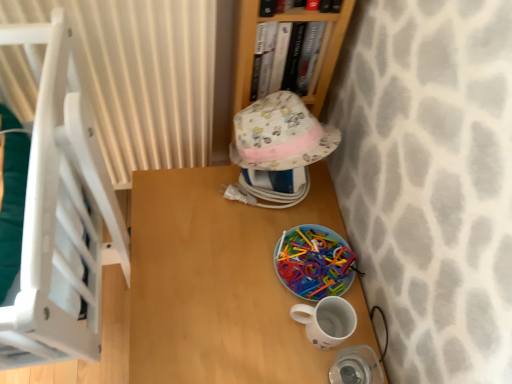
Describe the element at coordinates (326, 321) in the screenshot. I see `white glossy mug at lower right` at that location.

Measure the distance between wooden table at center and camera.

wooden table at center and camera are 31.67 inches apart.

Identify the location of wooden table at center. (222, 283).

Measure the distance between point (x=259, y=14) and camera.

They are 31.46 inches apart.

What do you see at coordinates (141, 76) in the screenshot? I see `beige striped curtain at upper left` at bounding box center [141, 76].

Where is `wooden bookshelf at upper center`? This screenshot has height=384, width=512. wooden bookshelf at upper center is located at coordinates (283, 21).

From the picture: Measure the distance between wooden bookshelf at upper center and camera.

wooden bookshelf at upper center is 30.41 inches away from camera.

This screenshot has width=512, height=384. What are the coordinates of `fluffy cotton hat at center` in the screenshot? It's located at (280, 134).

How different are the orientations of wooden table at center and fluffy cotton hat at center in degrees?

0.343 degrees.

From their relative heights in the image, would you say wooden table at center is taller or shorter than fluffy cotton hat at center?

Clearly, wooden table at center is taller compared to fluffy cotton hat at center.

Does wooden table at center lie behind fluffy cotton hat at center?

No, wooden table at center is closer to the camera.

Is wooden table at center oriented towards fluffy cotton hat at center?

No, wooden table at center is not aimed at fluffy cotton hat at center.

Which object is positioned more to the left, beige striped curtain at upper left or hardcover book at upper center?

From the viewer's perspective, beige striped curtain at upper left appears more on the left side.

Who is bigger, beige striped curtain at upper left or hardcover book at upper center?

Bigger between the two is beige striped curtain at upper left.

Is there a large distance between beige striped curtain at upper left and hardcover book at upper center?

Actually, beige striped curtain at upper left and hardcover book at upper center are a little close together.

Are hardcover book at upper center and wooden bookshelf at upper center located far from each other?

hardcover book at upper center is actually quite close to wooden bookshelf at upper center.

Who is smaller, hardcover book at upper center or wooden bookshelf at upper center?

With smaller size is hardcover book at upper center.

Which is more to the left, hardcover book at upper center or wooden bookshelf at upper center?

wooden bookshelf at upper center is more to the left.

From a real-world perspective, is hardcover book at upper center positioned above or below wooden bookshelf at upper center?

From a real-world perspective, hardcover book at upper center is physically above wooden bookshelf at upper center.

What's the angular difference between wooden table at center and wooden bookshelf at upper center's facing directions?

They differ by 85.5 degrees in their facing directions.

Relative to wooden bookshelf at upper center, is wooden table at center in front or behind?

Visually, wooden table at center is located in front of wooden bookshelf at upper center.

How distant is wooden table at center from wooden bookshelf at upper center?

wooden table at center and wooden bookshelf at upper center are 14.02 inches apart from each other.

From a real-world perspective, which is physically below, wooden table at center or wooden bookshelf at upper center?

wooden table at center, from a real-world perspective.

What's the angular difference between hardcover book at upper center and fluffy cotton hat at center's facing directions?

85.1 degrees.

Would you consider hardcover book at upper center to be distant from fluffy cotton hat at center?

hardcover book at upper center is near fluffy cotton hat at center, not far away.

Is hardcover book at upper center inside the boundaries of fluffy cotton hat at center, or outside?

hardcover book at upper center exists outside the volume of fluffy cotton hat at center.

Could you tell me if hardcover book at upper center is facing fluffy cotton hat at center?

No, hardcover book at upper center is not aimed at fluffy cotton hat at center.

Between point (348, 311) and point (238, 35), which one is positioned in front?

The point (348, 311) is closer to the camera.

Do you think white glossy mug at lower right is within wooden bookshelf at upper center, or outside of it?

white glossy mug at lower right cannot be found inside wooden bookshelf at upper center.

Identify the location of bookcase that appears behind the white glossy mug at lower right. The height and width of the screenshot is (384, 512). (283, 21).

Between white glossy mug at lower right and wooden bookshelf at upper center, which one has smaller width?

Thinner between the two is white glossy mug at lower right.

From the image's perspective, is wooden bookshelf at upper center above hardcover book at upper center?

No, from the image's perspective, wooden bookshelf at upper center is not on top of hardcover book at upper center.

Is the depth of wooden bookshelf at upper center less than that of hardcover book at upper center?

No, it is not.

Is wooden bookshelf at upper center surrounding hardcover book at upper center?

No, hardcover book at upper center is not a part of wooden bookshelf at upper center.

Can you tell me how much wooden bookshelf at upper center and hardcover book at upper center differ in facing direction?

There is a 0.00107-degree angle between the facing directions of wooden bookshelf at upper center and hardcover book at upper center.

Where is `hat behind the wooden table at center`? This screenshot has width=512, height=384. hat behind the wooden table at center is located at coordinates (280, 134).

At what (x,y) coordinates should I click in order to perform the action: click on book on the right side of beige striped curtain at upper left. Please return your answer as a coordinate pair (x, y). This screenshot has width=512, height=384. Looking at the image, I should click on (271, 7).

From the image, which object appears to be nearer to beige striped curtain at upper left, wooden bookshelf at upper center or wooden table at center?

Based on the image, wooden bookshelf at upper center appears to be nearer to beige striped curtain at upper left.

In the scene shown: When comparing their distances from white glossy mug at lower right, does fluffy cotton hat at center or wooden bookshelf at upper center seem closer?

fluffy cotton hat at center lies closer to white glossy mug at lower right than the other object.

Looking at the image, which one is located further to beige striped curtain at upper left, hardcover book at upper center or white glossy mug at lower right?

Among the two, white glossy mug at lower right is located further to beige striped curtain at upper left.

Estimate the real-world distances between objects in this image. Which object is closer to fluffy cotton hat at center, wooden bookshelf at upper center or white glossy mug at lower right?

Based on the image, wooden bookshelf at upper center appears to be nearer to fluffy cotton hat at center.

Estimate the real-world distances between objects in this image. Which object is closer to wooden bookshelf at upper center, wooden table at center or fluffy cotton hat at center?

fluffy cotton hat at center is closer to wooden bookshelf at upper center.

When comparing their distances from beige striped curtain at upper left, does wooden table at center or fluffy cotton hat at center seem further?

Based on the image, wooden table at center appears to be further to beige striped curtain at upper left.

Estimate the real-world distances between objects in this image. Which object is further from white glossy mug at lower right, beige striped curtain at upper left or wooden bookshelf at upper center?

The object further to white glossy mug at lower right is beige striped curtain at upper left.

Estimate the real-world distances between objects in this image. Which object is closer to wooden table at center, white glossy mug at lower right or wooden bookshelf at upper center?

white glossy mug at lower right is positioned closer to the anchor wooden table at center.

This screenshot has width=512, height=384. I want to click on curtain between wooden bookshelf at upper center and wooden table at center from top to bottom, so click(x=141, y=76).

This screenshot has width=512, height=384. I want to click on hat between hardcover book at upper center and white glossy mug at lower right from top to bottom, so click(280, 134).

The height and width of the screenshot is (384, 512). In order to click on hat between wooden bookshelf at upper center and white glossy mug at lower right from top to bottom in this screenshot , I will do `click(280, 134)`.

I want to click on bookcase between hardcover book at upper center and white glossy mug at lower right vertically, so click(x=283, y=21).